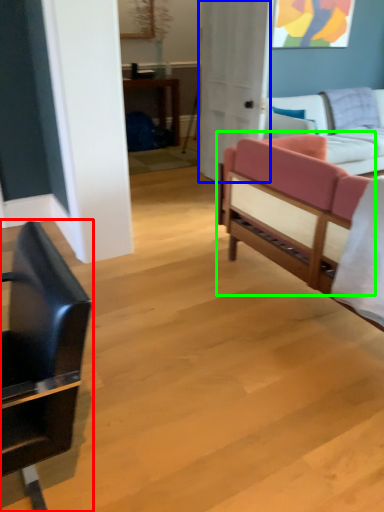
Question: Considering the real-world distances, which object is closest to chair (highlighted by a red box)? glass door (highlighted by a blue box) or studio couch (highlighted by a green box).

Choices:
 (A) glass door
 (B) studio couch

Answer: (B)